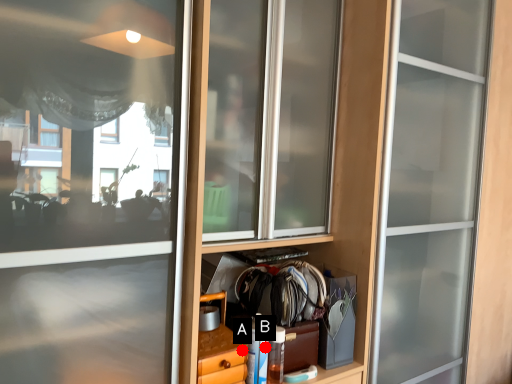
Question: Two points are circled on the image, labeled by A and B beside each circle. Which point is closer to the camera?

Choices:
 (A) A is closer
 (B) B is closer

Answer: (A)